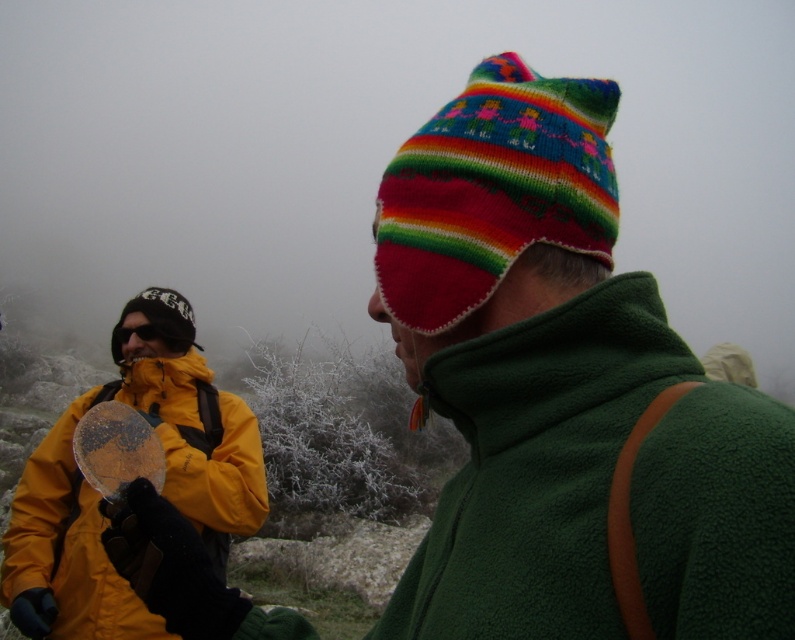
Question: Which object appears closest to the camera in this image?

Choices:
 (A) yellow fleece jacket at left
 (B) green fleece jacket at right

Answer: (B)

Question: Can you confirm if green fleece jacket at right is wider than yellow fleece jacket at left?

Choices:
 (A) yes
 (B) no

Answer: (B)

Question: Can you confirm if green fleece jacket at right is wider than yellow fleece jacket at left?

Choices:
 (A) yes
 (B) no

Answer: (B)

Question: Is green fleece jacket at right closer to the viewer compared to yellow fleece jacket at left?

Choices:
 (A) no
 (B) yes

Answer: (B)

Question: Among these objects, which one is farthest from the camera?

Choices:
 (A) yellow fleece jacket at left
 (B) green fleece jacket at right

Answer: (A)

Question: Which point is farther from the camera taking this photo?

Choices:
 (A) (782, 413)
 (B) (262, 518)

Answer: (B)